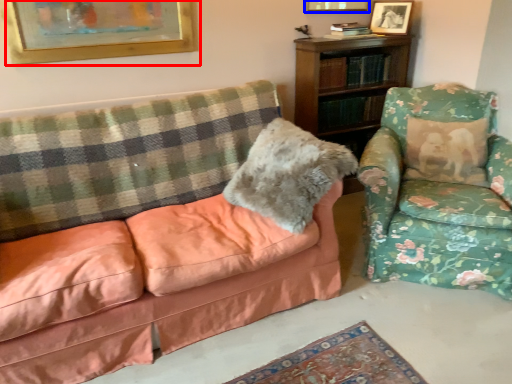
Question: Among these objects, which one is nearest to the camera, picture frame (highlighted by a red box) or picture frame (highlighted by a blue box)?

Choices:
 (A) picture frame
 (B) picture frame

Answer: (A)